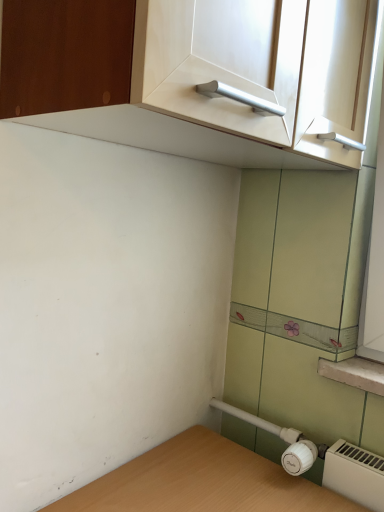
Where is `white glossy cabinet handle at upper center`? The image size is (384, 512). white glossy cabinet handle at upper center is located at coordinates (260, 85).

Image resolution: width=384 pixels, height=512 pixels. Describe the element at coordinates (260, 85) in the screenshot. I see `white glossy cabinet handle at upper center` at that location.

Identify the location of white glossy cabinet handle at upper center. This screenshot has width=384, height=512. (260, 85).